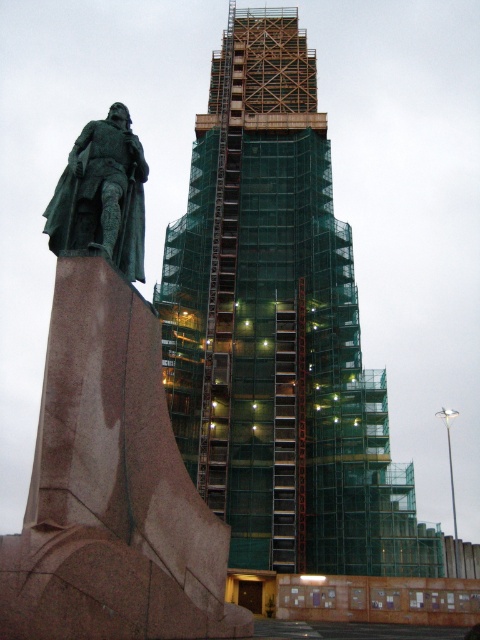
Question: Where is green mesh scaffolding at center located in relation to green patina statue at left in the image?

Choices:
 (A) below
 (B) above

Answer: (B)

Question: Which of the following is the farthest from the observer?

Choices:
 (A) (80, 176)
 (B) (404, 468)

Answer: (B)

Question: Is green mesh scaffolding at center in front of green patina statue at left?

Choices:
 (A) no
 (B) yes

Answer: (A)

Question: Which point is farther from the camera taking this photo?

Choices:
 (A) (133, 493)
 (B) (99, 209)

Answer: (B)

Question: Where is green mesh scaffolding at center located in relation to green patina statue at left in the image?

Choices:
 (A) right
 (B) left

Answer: (A)

Question: Which point is closer to the camera?

Choices:
 (A) green mesh scaffolding at center
 (B) green polished stone statue at left

Answer: (B)